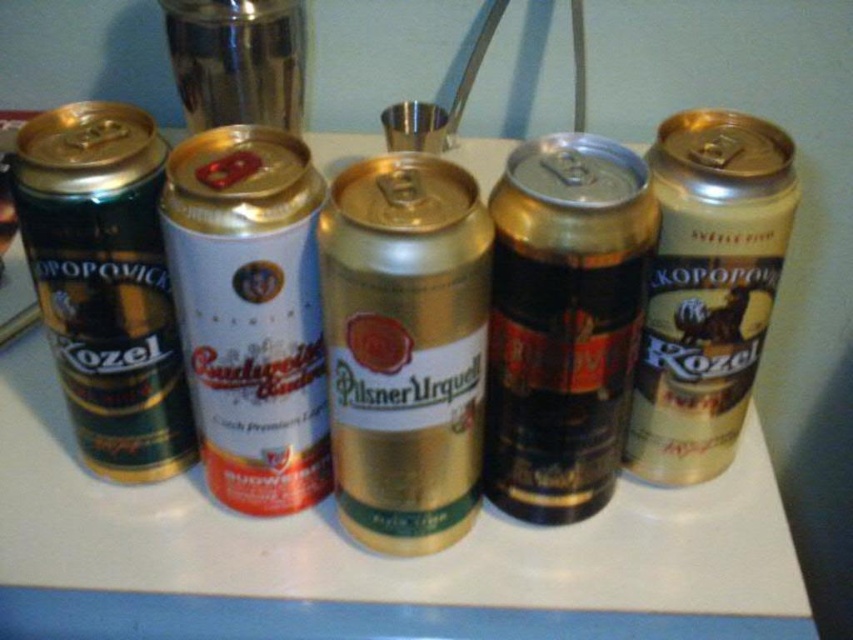
Does white matte can at center have a greater height compared to shiny green can at left?

Result: No, white matte can at center is not taller than shiny green can at left.

Based on the photo, is white matte can at center further to camera compared to shiny green can at left?

No, white matte can at center is in front of shiny green can at left.

You are a GUI agent. You are given a task and a screenshot of the screen. Output one action in this format:
    pyautogui.click(x=<x>, y=<y>)
    Task: Click on the white matte can at center
    
    Given the screenshot: What is the action you would take?
    pyautogui.click(x=250, y=312)

Find the location of `white matte can at center`. white matte can at center is located at coordinates (250, 312).

Is gold metallic can at center closer to the viewer compared to shiny metallic can at center?

Yes, it is in front of shiny metallic can at center.

Who is lower down, gold metallic can at center or shiny metallic can at center?

gold metallic can at center is below.

Looking at this image, who is more distant from viewer, (x=473, y=454) or (x=608, y=406)?

The point (x=473, y=454) is more distant.

Identify the location of gold metallic can at center. The height and width of the screenshot is (640, 853). (405, 348).

Does gold metallic can at center have a larger size compared to shiny green can at left?

No.

Does gold metallic can at center lie in front of shiny green can at left?

Yes, it is.

Identify the location of gold metallic can at center. (405, 348).

Locate an element on the screen. This screenshot has height=640, width=853. gold metallic can at center is located at coordinates [x=405, y=348].